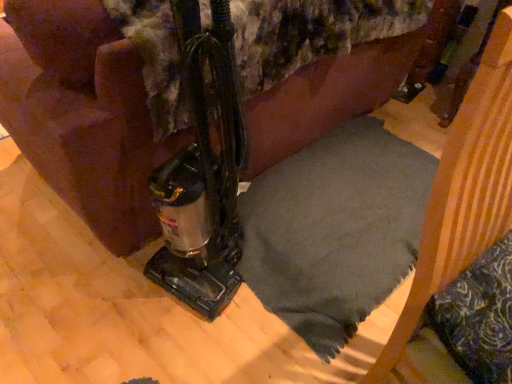
Question: Is dark gray fabric cushion at center looking in the opposite direction of velvety green pillow at lower right?

Choices:
 (A) no
 (B) yes

Answer: (B)

Question: Are dark gray fabric cushion at center and velvety green pillow at lower right making contact?

Choices:
 (A) no
 (B) yes

Answer: (A)

Question: From a real-world perspective, is dark gray fabric cushion at center under velvety green pillow at lower right?

Choices:
 (A) yes
 (B) no

Answer: (B)

Question: Does dark gray fabric cushion at center have a larger size compared to velvety green pillow at lower right?

Choices:
 (A) yes
 (B) no

Answer: (A)

Question: Is dark gray fabric cushion at center to the right of velvety green pillow at lower right from the viewer's perspective?

Choices:
 (A) yes
 (B) no

Answer: (A)

Question: Does dark gray fabric cushion at center have a greater height compared to velvety green pillow at lower right?

Choices:
 (A) no
 (B) yes

Answer: (B)

Question: Would you say velvety green pillow at lower right contains dark gray fabric cushion at center?

Choices:
 (A) yes
 (B) no

Answer: (B)

Question: Does velvety green pillow at lower right have a smaller size compared to dark gray fabric cushion at center?

Choices:
 (A) yes
 (B) no

Answer: (A)

Question: Considering the relative sizes of velvety green pillow at lower right and dark gray fabric cushion at center in the image provided, is velvety green pillow at lower right thinner than dark gray fabric cushion at center?

Choices:
 (A) yes
 (B) no

Answer: (B)

Question: From the image's perspective, is velvety green pillow at lower right over dark gray fabric cushion at center?

Choices:
 (A) no
 (B) yes

Answer: (A)

Question: Is velvety green pillow at lower right positioned in front of dark gray fabric cushion at center?

Choices:
 (A) yes
 (B) no

Answer: (B)

Question: Is velvety green pillow at lower right shorter than dark gray fabric cushion at center?

Choices:
 (A) yes
 (B) no

Answer: (A)

Question: Relative to dark gray fabric cushion at center, is velvety green pillow at lower right in front or behind?

Choices:
 (A) front
 (B) behind

Answer: (B)